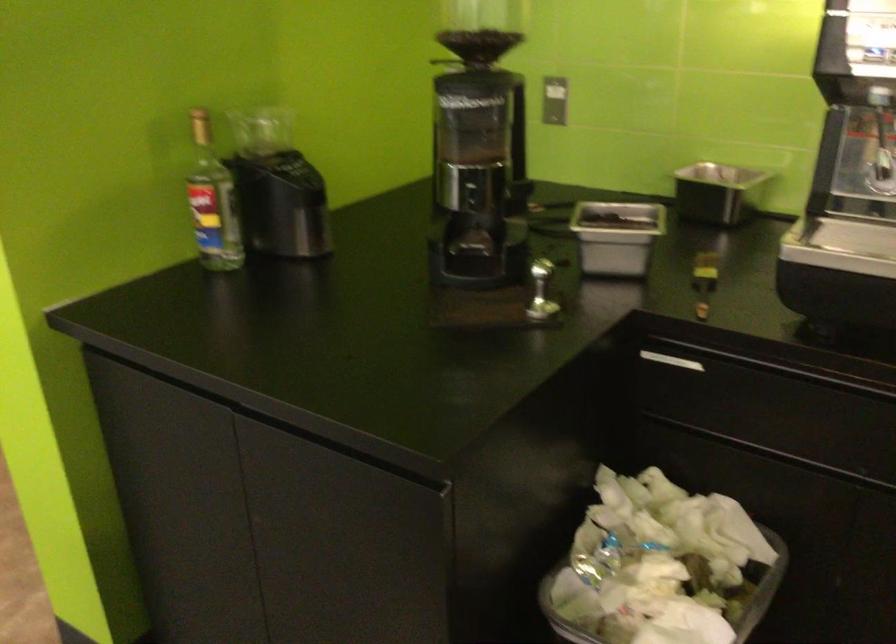
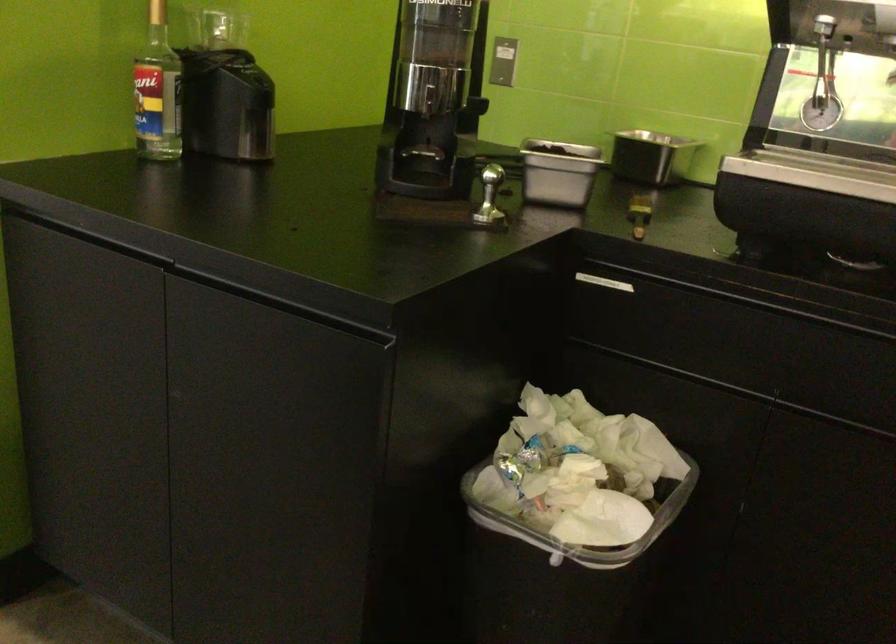
In the second image, find the point that corresponds to point 211,209 in the first image.

(158, 91)